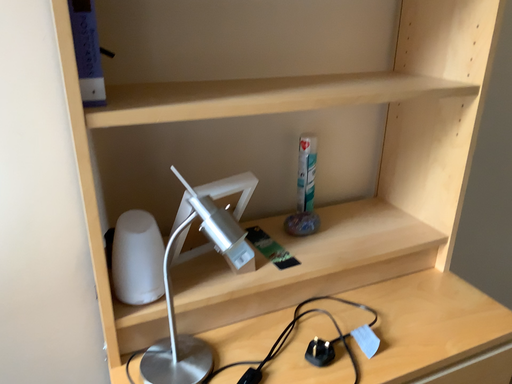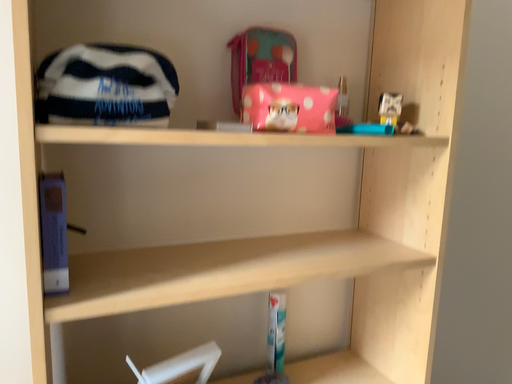
Question: How did the camera likely rotate when shooting the video?

Choices:
 (A) rotated downward
 (B) rotated upward

Answer: (B)